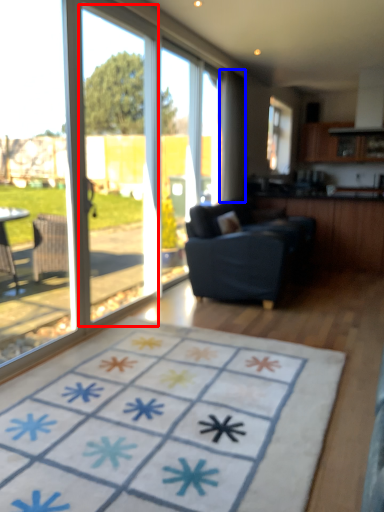
Question: Which object appears farthest to the camera in this image, screen door (highlighted by a red box) or curtain (highlighted by a blue box)?

Choices:
 (A) screen door
 (B) curtain

Answer: (B)